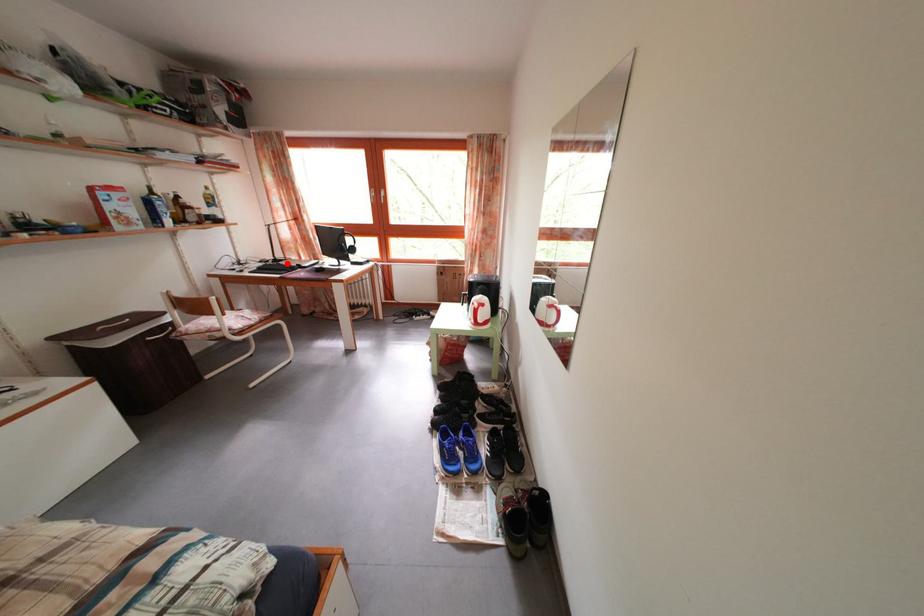
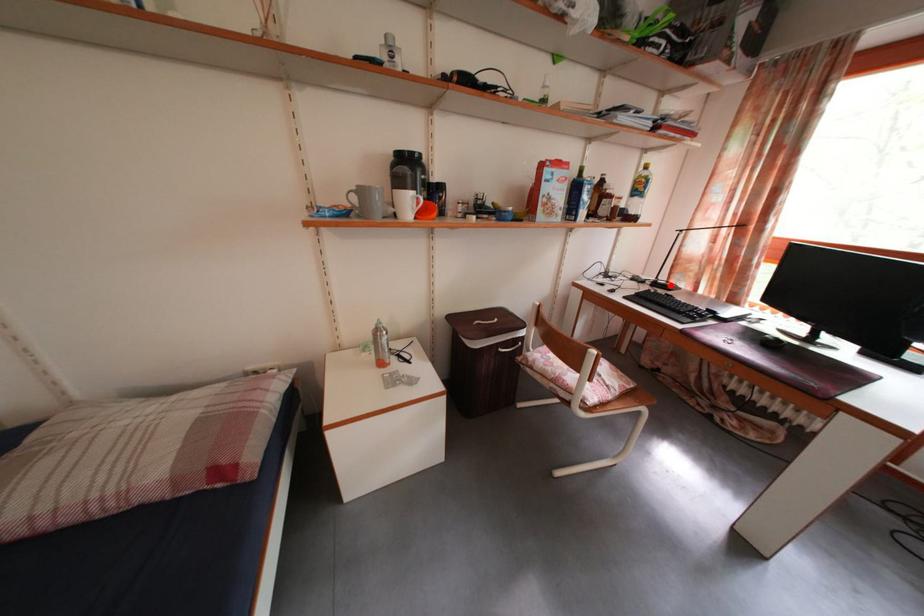
From the picture: I am providing you with two images of the same scene from different viewpoints. A red point is marked on the first image and another point is marked on the second image. Is the marked point in image1 the same physical position as the marked point in image2?

Yes